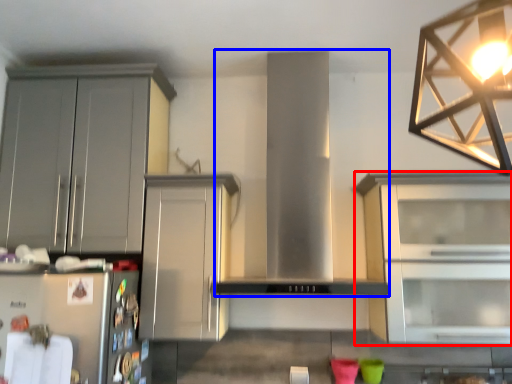
Question: Among these objects, which one is nearest to the camera, cabinetry (highlighted by a red box) or hood (highlighted by a blue box)?

Choices:
 (A) cabinetry
 (B) hood

Answer: (B)